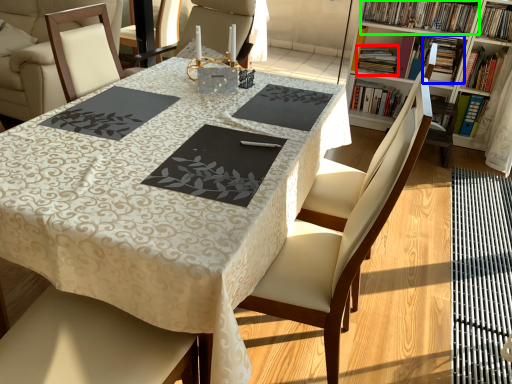
Question: Based on their relative distances, which object is farther from book (highlighted by a red box)? Choose from book (highlighted by a blue box) and book (highlighted by a green box).

Choices:
 (A) book
 (B) book

Answer: (B)